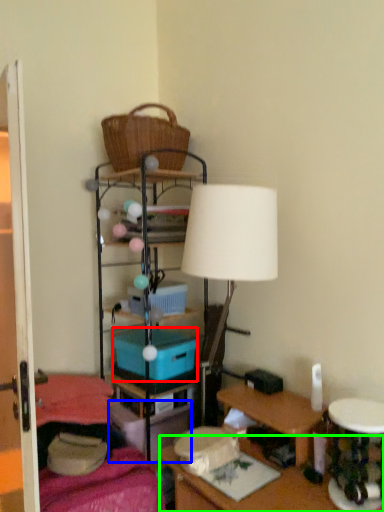
Question: Considering the real-world distances, which object is closest to storage box (highlighted by a red box)? storage box (highlighted by a blue box) or desk (highlighted by a green box).

Choices:
 (A) storage box
 (B) desk

Answer: (A)